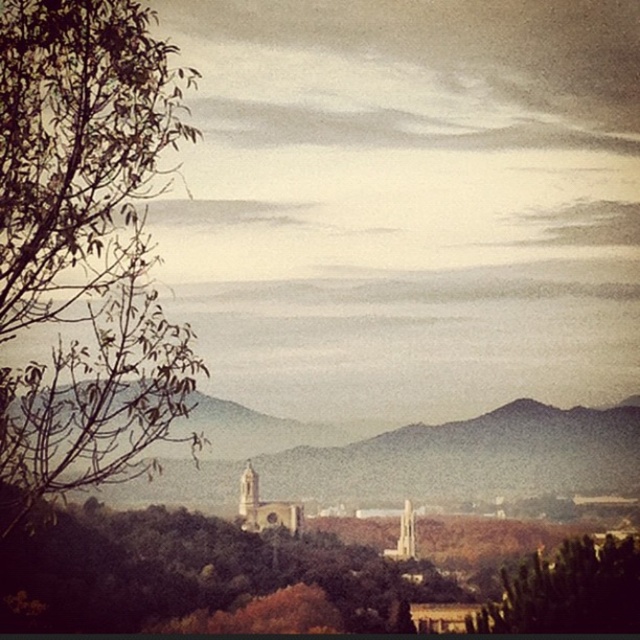
Question: Which point appears farthest from the camera in this image?

Choices:
 (A) (602, 596)
 (B) (180, 355)

Answer: (A)

Question: Can you confirm if green leafy tree at left is bigger than green leafy tree at lower right?

Choices:
 (A) no
 (B) yes

Answer: (B)

Question: Does green leafy tree at left have a greater width compared to brown stone church at center?

Choices:
 (A) no
 (B) yes

Answer: (A)

Question: Which of the following is the farthest from the observer?

Choices:
 (A) (464, 432)
 (B) (67, 136)
 (C) (589, 627)

Answer: (C)

Question: Where is green leafy tree at left located in relation to brown stone church at center in the image?

Choices:
 (A) right
 (B) left

Answer: (B)

Question: Estimate the real-world distances between objects in this image. Which object is closer to the brown stone church at center?

Choices:
 (A) green leafy tree at left
 (B) green leafy tree at lower right

Answer: (B)